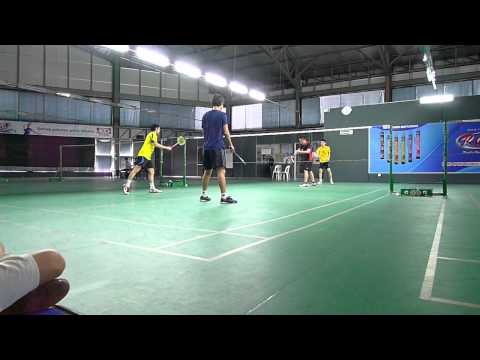
Identify the location of hanging lights. This screenshot has height=360, width=480. (182, 68), (215, 78), (236, 84), (255, 95), (149, 55), (120, 50).